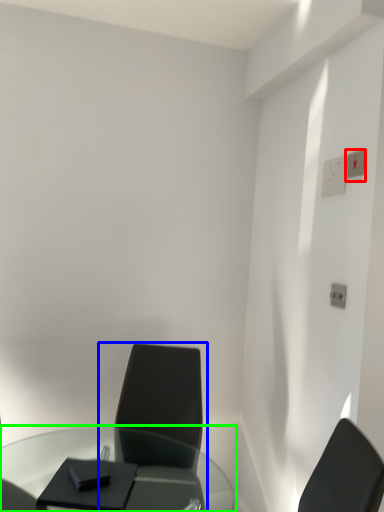
Question: Based on their relative distances, which object is farther from electric outlet (highlighted by a red box)? Choose from chair (highlighted by a blue box) and table (highlighted by a green box).

Choices:
 (A) chair
 (B) table

Answer: (B)